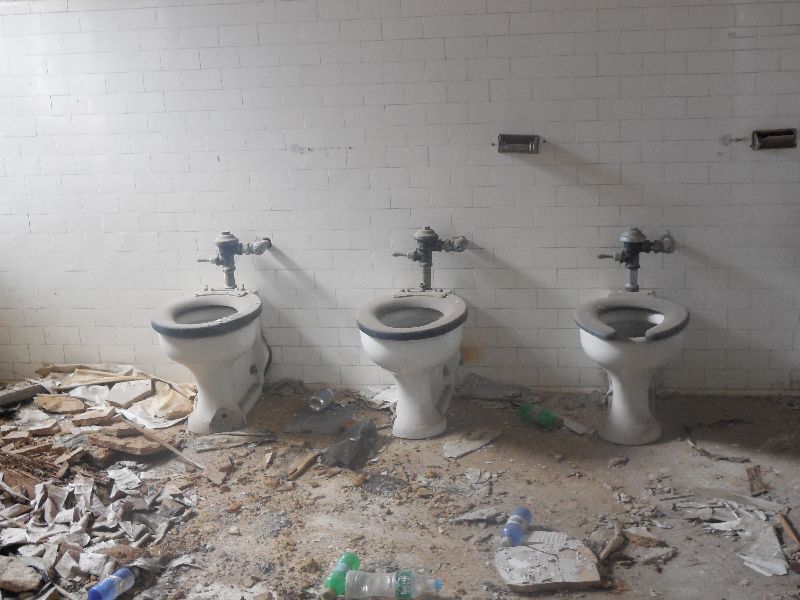
At what (x,y) coordinates should I click in order to perform the action: click on seat. Please return your answer as a coordinate pair (x, y). Looking at the image, I should click on (662, 326).